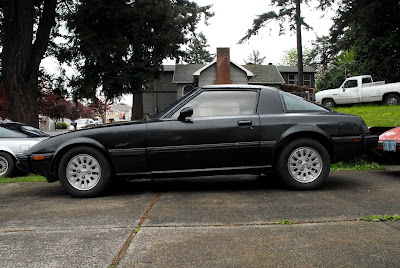
Identify the location of door handle. (246, 118), (356, 87).